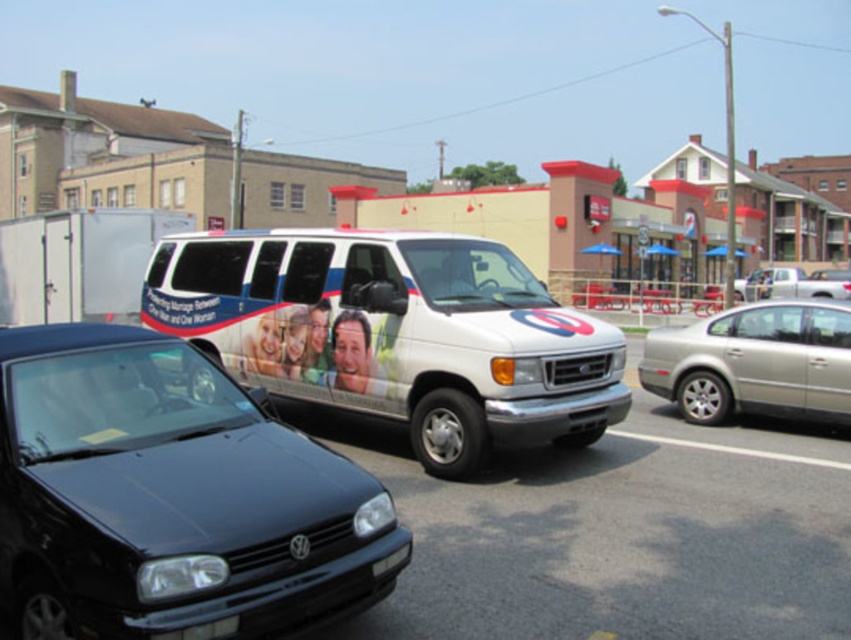
Question: Observing the image, what is the correct spatial positioning of white glossy van at center in reference to white matte truck at right?

Choices:
 (A) below
 (B) above

Answer: (A)

Question: Does white glossy van at center lie in front of white matte truck at right?

Choices:
 (A) yes
 (B) no

Answer: (A)

Question: Which point is farther from the camera taking this photo?

Choices:
 (A) (383, 499)
 (B) (672, 388)

Answer: (B)

Question: Which point appears farthest from the camera in this image?

Choices:
 (A) (817, 282)
 (B) (421, 248)

Answer: (A)

Question: Which of these objects is positioned farthest from the white glossy van at center?

Choices:
 (A) white matte truck at right
 (B) black matte hatchback at lower left
 (C) silver metallic sedan at right

Answer: (A)

Question: Can you confirm if white glossy van at center is wider than silver metallic sedan at right?

Choices:
 (A) yes
 (B) no

Answer: (B)